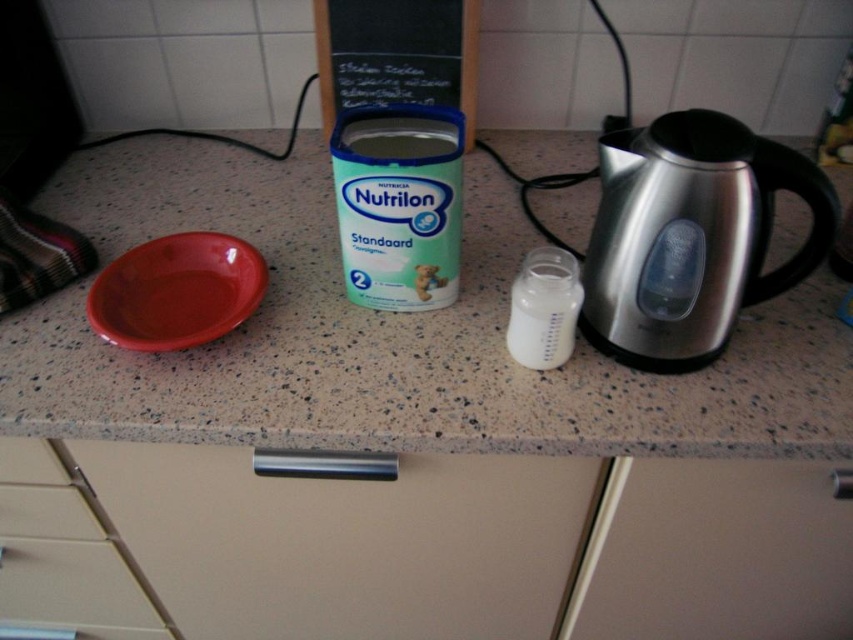
Question: In this image, where is white matte canister at center located relative to matte plastic bowl at left?

Choices:
 (A) above
 (B) below

Answer: (A)

Question: Which object is positioned closest to the satin silver kettle at right?

Choices:
 (A) blue cardboard box at center
 (B) speckled granite countertop at center

Answer: (B)

Question: Which of the following is the farthest from the observer?

Choices:
 (A) (165, 324)
 (B) (538, 272)

Answer: (A)

Question: Can you confirm if blue cardboard box at center is wider than matte plastic bowl at left?

Choices:
 (A) no
 (B) yes

Answer: (B)

Question: Which object is farther from the camera taking this photo?

Choices:
 (A) blue cardboard box at center
 (B) translucent plastic bottle at center
 (C) satin silver kettle at right
 (D) matte plastic bowl at left

Answer: (A)

Question: Is speckled granite countertop at center wider than translucent plastic bottle at center?

Choices:
 (A) no
 (B) yes

Answer: (B)